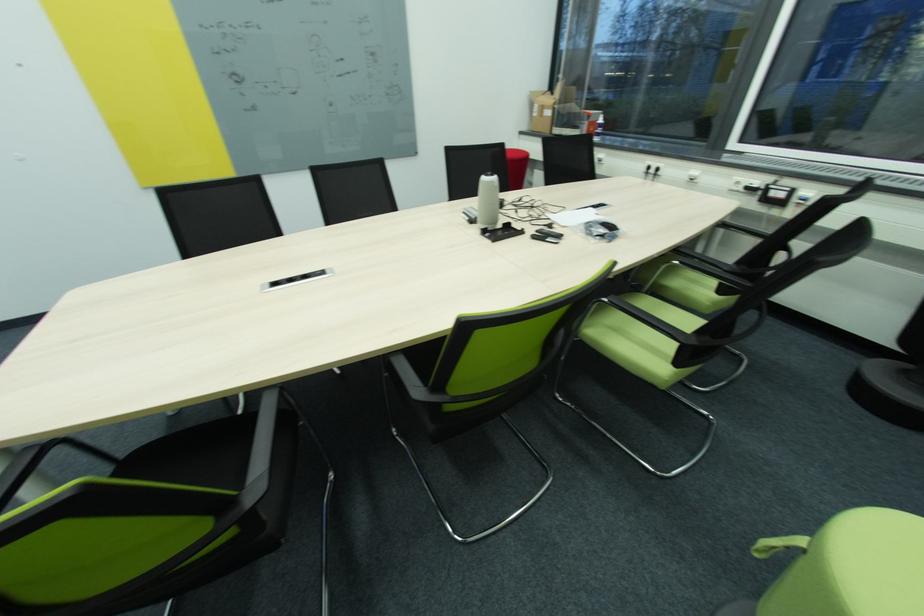
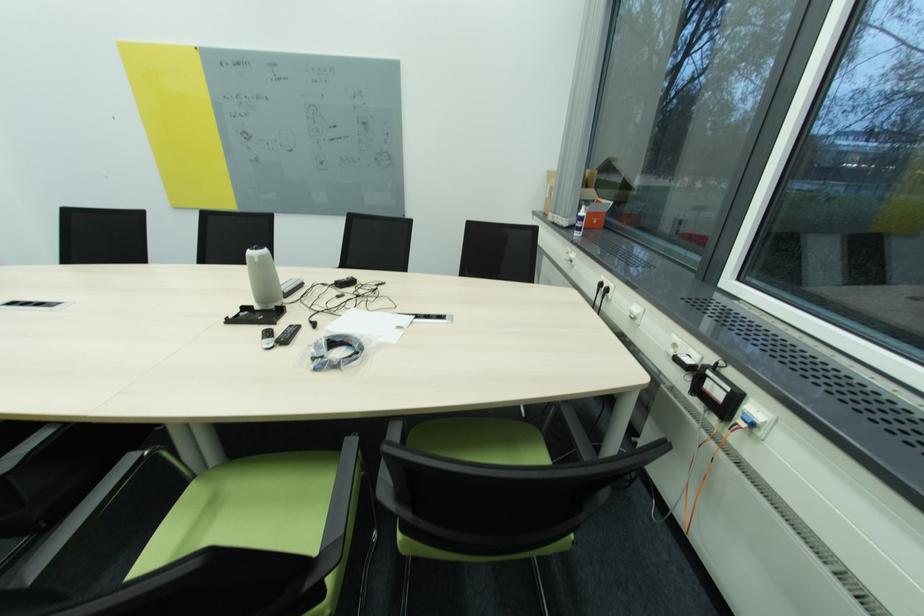
Question: I am providing you with two images of the same scene from different viewpoints. After the viewpoint changes to image2, which objects are now occluded?

Choices:
 (A) green chair sitting surface
 (B) black chair armrest
 (C) coiled black cable
 (D) none of these

Answer: (D)